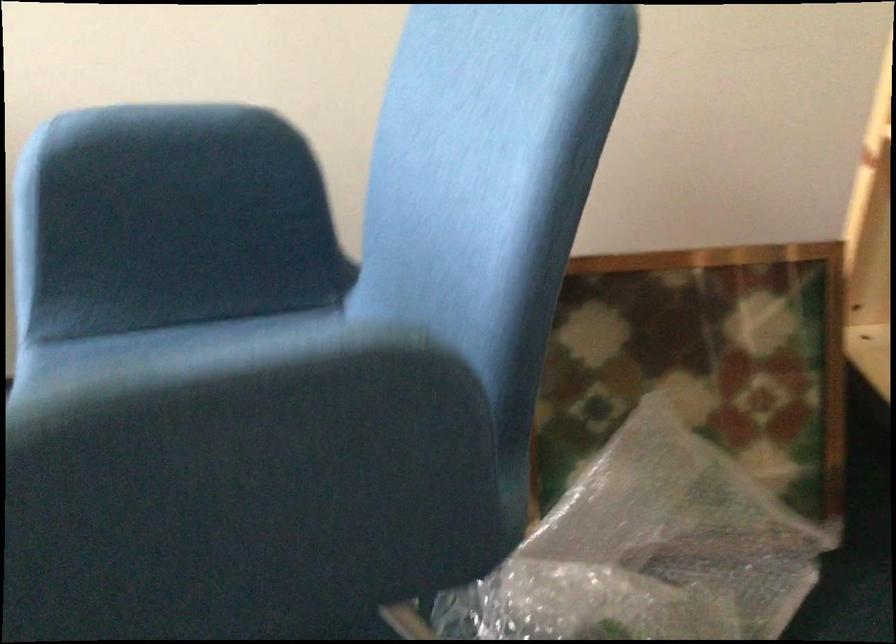
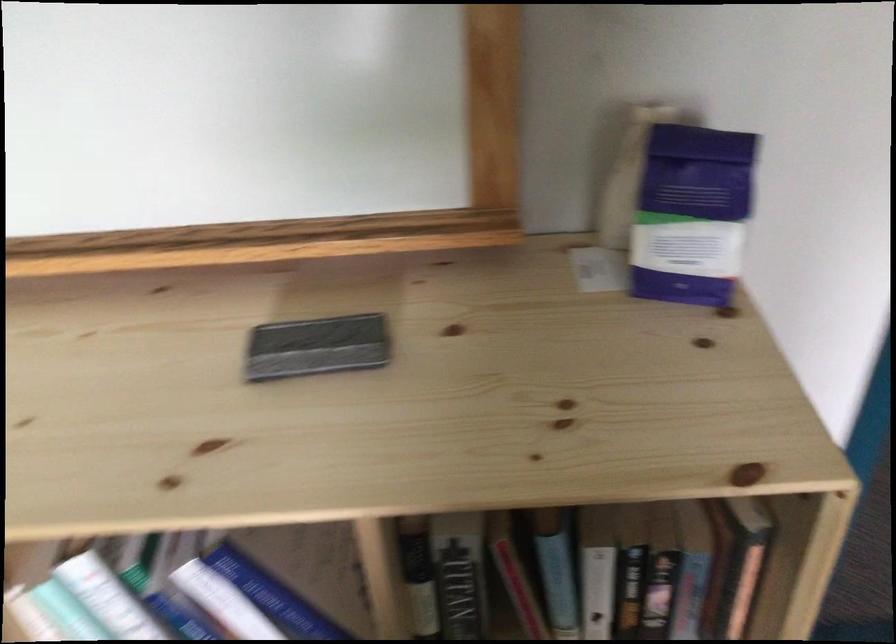
Based on the continuous images, in which direction is the camera rotating?

The camera's rotation is toward right-down.